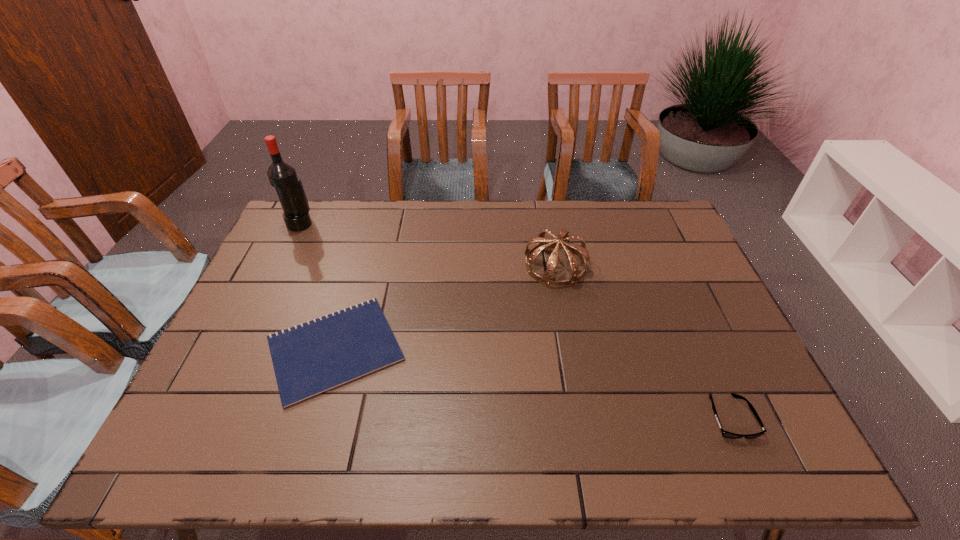
You are a GUI agent. You are given a task and a screenshot of the screen. Output one action in this format:
    pyautogui.click(x=<x>, y=<y>)
    Task: Click on the vacant space at the left edge of the desktop
    The width and height of the screenshot is (960, 540).
    Given the screenshot: What is the action you would take?
    pyautogui.click(x=276, y=330)

Where is `vacant space at the right edge of the desktop`? vacant space at the right edge of the desktop is located at coordinates (699, 282).

The height and width of the screenshot is (540, 960). In the image, there is a desktop. What are the coordinates of `vacant space at the far left corner` in the screenshot? It's located at (310, 202).

This screenshot has width=960, height=540. In order to click on vacant point located between the sunglasses and the third shortest object in this screenshot , I will do `click(643, 341)`.

Identify the location of free area in between the third tallest object and the shortest object. The image size is (960, 540). (533, 383).

Find the location of `free area in between the tallest object and the second object from right to left`. free area in between the tallest object and the second object from right to left is located at coordinates (428, 245).

Locate an element on the screen. The width and height of the screenshot is (960, 540). free space between the tiara and the wine bottle is located at coordinates (428, 245).

At what (x,y) coordinates should I click in order to perform the action: click on vacant space that's between the second object from left to right and the leftmost object. Please return your answer as a coordinate pair (x, y). The width and height of the screenshot is (960, 540). Looking at the image, I should click on (318, 286).

This screenshot has width=960, height=540. I want to click on free point between the farthest object and the sunglasses, so click(x=516, y=320).

I want to click on vacant area that lies between the rightmost object and the tiara, so click(643, 341).